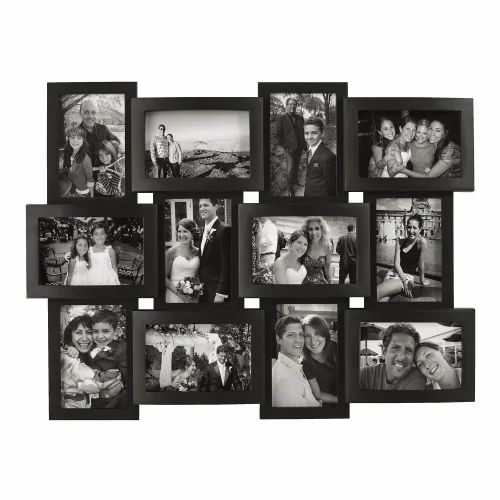
Locate an element on the screen. The height and width of the screenshot is (500, 500). bottom row of photos is located at coordinates (95, 378), (182, 356), (321, 360), (411, 371).